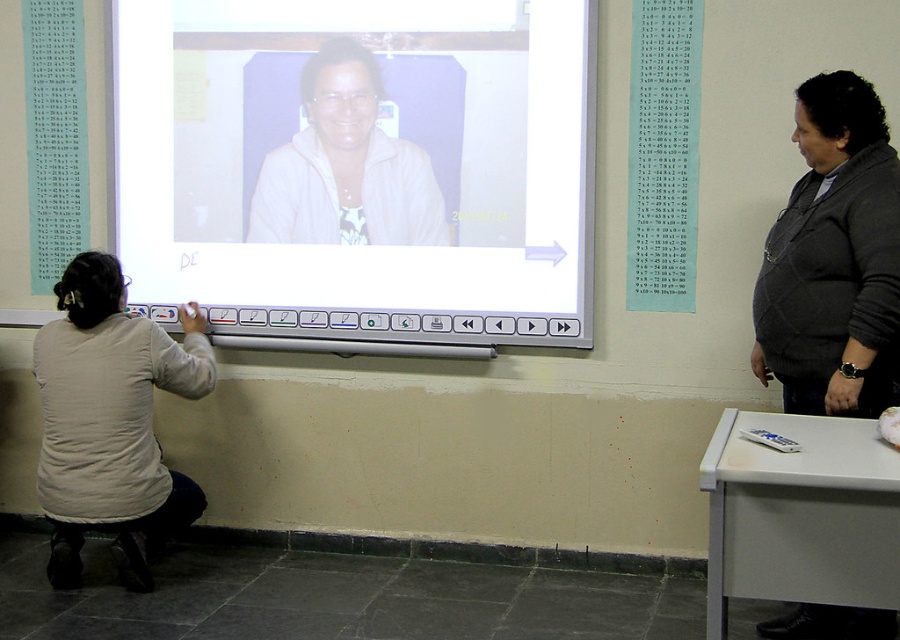
Does point (562, 104) lie behind point (866, 99)?

Yes, it is behind point (866, 99).

Locate an element on the screen. The image size is (900, 640). white glossy projector screen at center is located at coordinates (360, 170).

Find the location of a particular element. This screenshot has width=900, height=640. white glossy projector screen at center is located at coordinates (360, 170).

Does point (492, 67) come farther from viewer compared to point (659, 88)?

Yes, it is.

Does white glossy projector screen at center have a larger size compared to white paper at upper right?

Yes.

Does point (568, 44) lie behind point (673, 234)?

No, (568, 44) is in front of (673, 234).

The image size is (900, 640). I want to click on white glossy projector screen at center, so click(360, 170).

Is white glossy projector screen at center to the left of light beige fabric shirt at lower left from the viewer's perspective?

In fact, white glossy projector screen at center is to the right of light beige fabric shirt at lower left.

Between point (303, 12) and point (58, 538), which one is positioned in front?

Positioned in front is point (58, 538).

This screenshot has width=900, height=640. I want to click on white glossy projector screen at center, so click(360, 170).